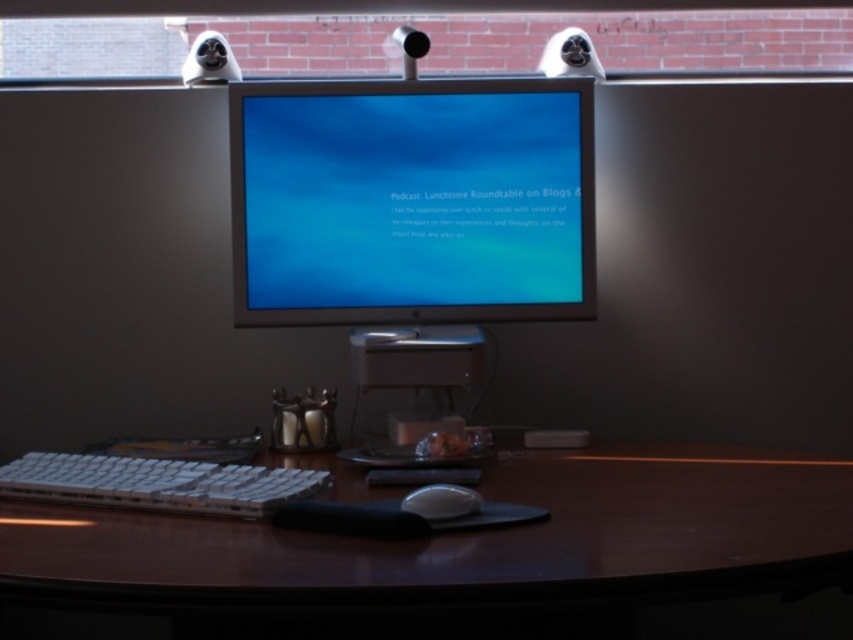
You are sitting at the desk and want to reach the brown wood table at center and the white plastic keyboard at lower left. Which object is closer to your hand if your hand is near the monitor?

The brown wood table at center is closer to your hand because it is closer to the viewer than the white plastic keyboard at lower left.

In the scene shown: You are setting up a new webcam for a video call and need to place it on the brown wood table at center. However, you also have the white matte mouse at center on the desk. Since the webcam requires a flat surface, will the area where the mouse is placed be suitable for the webcam?

The brown wood table at center is taller than the white matte mouse at center, so the mouse is lower than the table surface. This means the area where the mouse is placed on the brown wood table at center has enough flat space for the webcam.

In the scene shown: You are organizing a workspace and see the brown wood table at center and the satin silver monitor at center. Which object is positioned to the right of the other?

The brown wood table at center is to the right of the satin silver monitor at center.